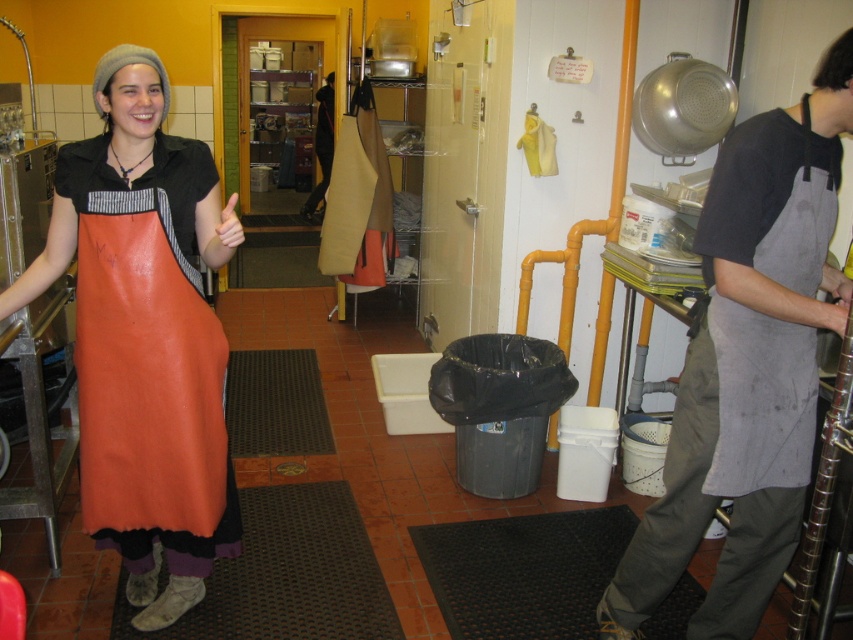
Which is above, gray apron at right or gray fabric apron at right?

Positioned higher is gray fabric apron at right.

Between gray apron at right and gray fabric apron at right, which one has less height?

With less height is gray fabric apron at right.

Does point (753, 141) come closer to viewer compared to point (735, 195)?

Yes, point (753, 141) is closer to viewer.

Locate an element on the screen. gray apron at right is located at coordinates (747, 365).

Can you confirm if orange leather apron at left is positioned to the left of skinny white hand at center?

Indeed, orange leather apron at left is positioned on the left side of skinny white hand at center.

In the scene shown: Which is below, orange leather apron at left or skinny white hand at center?

Positioned lower is orange leather apron at left.

This screenshot has width=853, height=640. Identify the location of orange leather apron at left. (142, 339).

Can you confirm if gray apron at right is wider than skinny white hand at center?

Correct, the width of gray apron at right exceeds that of skinny white hand at center.

You are a GUI agent. You are given a task and a screenshot of the screen. Output one action in this format:
    pyautogui.click(x=<x>, y=<y>)
    Task: Click on the gray apron at right
    The width and height of the screenshot is (853, 640).
    Given the screenshot: What is the action you would take?
    pyautogui.click(x=747, y=365)